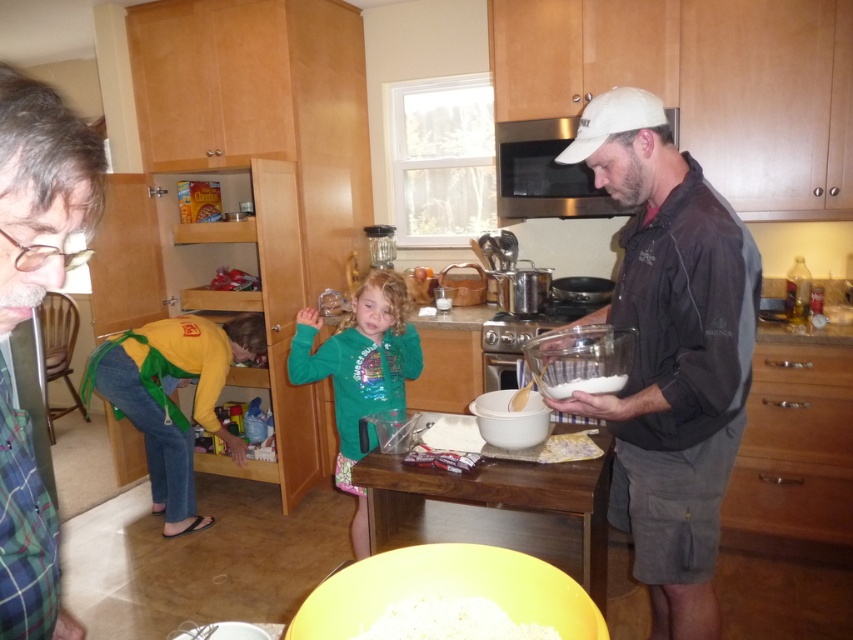
Can you confirm if green matte shirt at center is positioned below white matte mixing bowl at center?

Yes, green matte shirt at center is below white matte mixing bowl at center.

This screenshot has width=853, height=640. I want to click on green matte shirt at center, so point(360,371).

Between matte black jacket at right and yellow matte bowl at center, which one has more height?

matte black jacket at right is taller.

Can you confirm if matte black jacket at right is thinner than yellow matte bowl at center?

Incorrect, matte black jacket at right's width is not less than yellow matte bowl at center's.

What do you see at coordinates (670, 353) in the screenshot?
I see `matte black jacket at right` at bounding box center [670, 353].

Where is `matte black jacket at right`? matte black jacket at right is located at coordinates pyautogui.click(x=670, y=353).

Is white matte mixing bowl at center to the left of yellow crumbly dough at center from the viewer's perspective?

Correct, you'll find white matte mixing bowl at center to the left of yellow crumbly dough at center.

Who is lower down, white matte mixing bowl at center or yellow crumbly dough at center?

yellow crumbly dough at center is below.

Which is in front, point (488, 440) or point (566, 442)?

Point (488, 440) is in front.

I want to click on white matte mixing bowl at center, so click(509, 419).